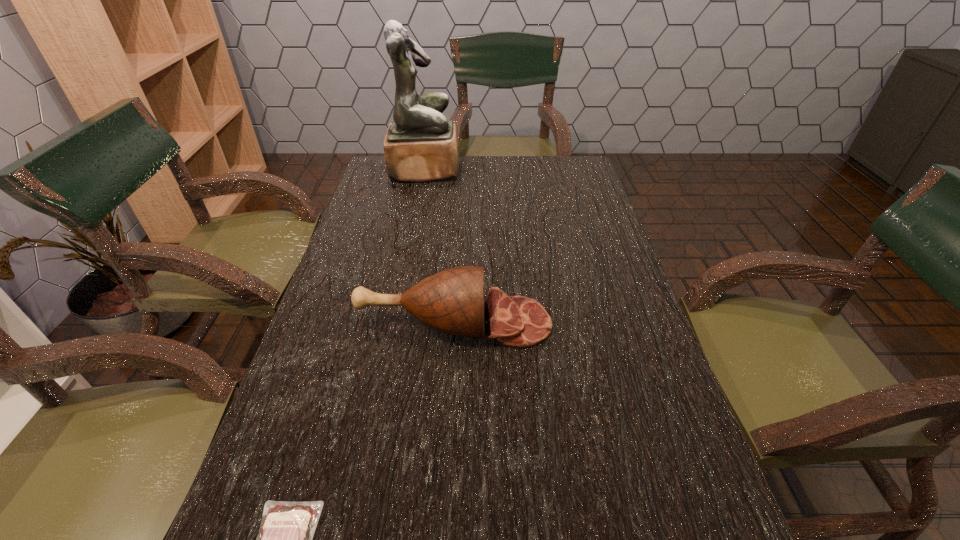
Image resolution: width=960 pixels, height=540 pixels. I want to click on the tallest object, so click(x=420, y=145).

Locate an element on the screen. The width and height of the screenshot is (960, 540). sculpture is located at coordinates (420, 145).

Locate an element on the screen. ham is located at coordinates (452, 301).

This screenshot has height=540, width=960. Find the location of `the second tallest object`. the second tallest object is located at coordinates (452, 301).

Image resolution: width=960 pixels, height=540 pixels. I want to click on free spot located 0.100m in a relaxed pose on the sculpture, so click(x=488, y=170).

This screenshot has height=540, width=960. Find the location of `vacant point located at the sliced end of the second tallest object`. vacant point located at the sliced end of the second tallest object is located at coordinates (621, 323).

Where is `object that is at the far edge`? Image resolution: width=960 pixels, height=540 pixels. object that is at the far edge is located at coordinates coord(420,145).

Where is `sculpture situated at the left edge`? The width and height of the screenshot is (960, 540). sculpture situated at the left edge is located at coordinates (420, 145).

Find the location of `ham at the left edge`. ham at the left edge is located at coordinates (452, 301).

The image size is (960, 540). What are the coordinates of `object located at the far left corner` in the screenshot? It's located at (420, 145).